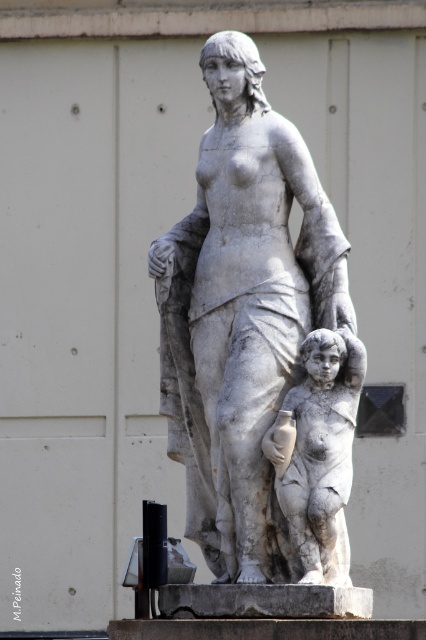
You are an art conservator assessing the statue. You need to determine if the white marble child at center is positioned lower than the white marble statue at center. Based on the description, what can you conclude?

The white marble statue at center is taller than the white marble child at center, so the child is positioned lower than the statue.

You are an art conservator planning to move the white marble statue at center and the white marble child at center to a new exhibition space. The entrance to the new space is 9 feet wide. Will both items fit through the entrance when moved together?

The distance between the white marble statue at center and the white marble child at center is 8.77 feet, which is less than the 9 feet wide entrance. Therefore, both items can fit through the entrance when moved together.

Based on the photo, you are an art conservator examining the classical marble statue. You need to clean both the white marble statue at center and the white marble child at center. Which one should you start with if you want to work from the closest to the farthest part first?

You should start with the white marble statue at center because it is closer to the viewer than the white marble child at center.